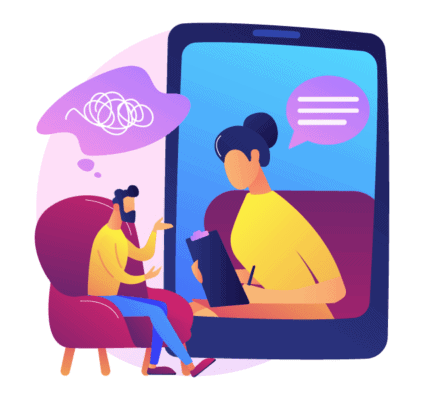
Find the location of `pen`. pen is located at coordinates (249, 279).